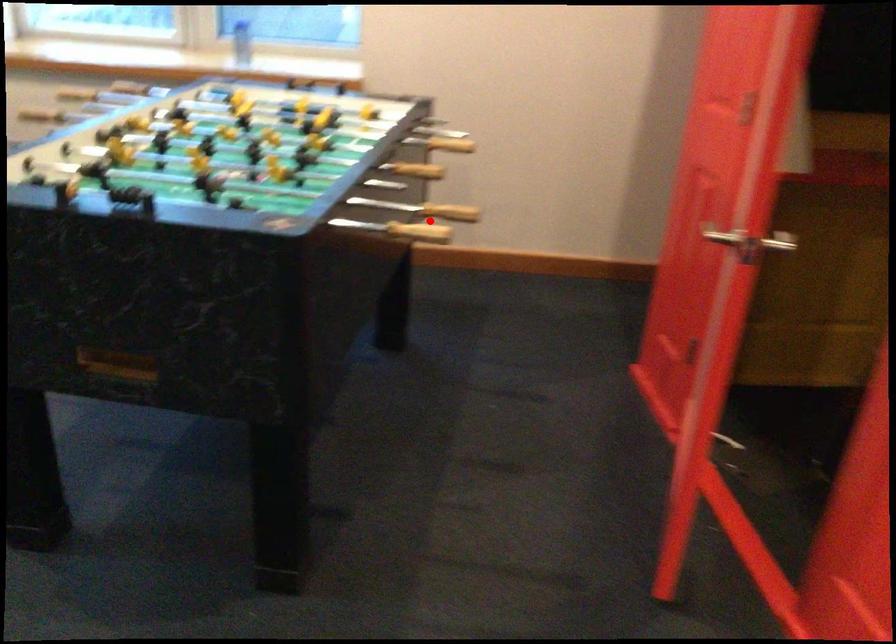
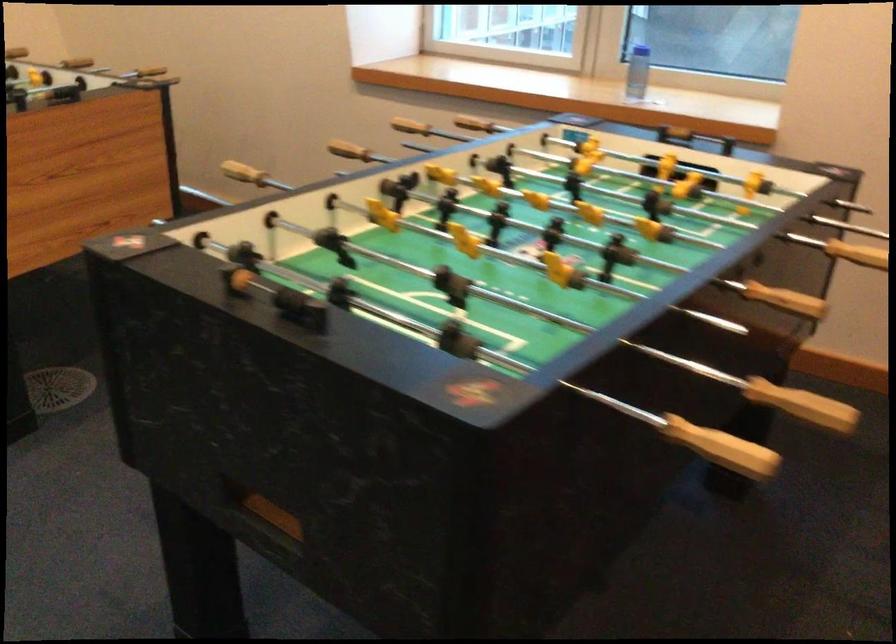
Where in the second image is the point corresponding to the highlighted location from the first image?

(722, 448)